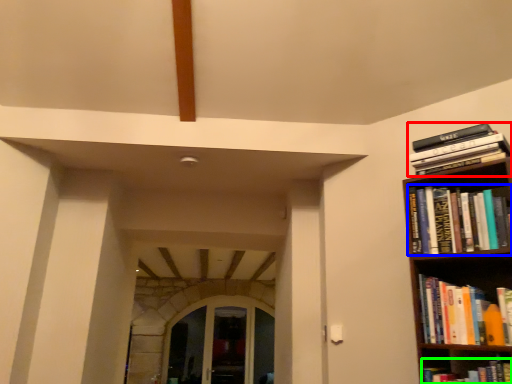
Question: Which object is positioned closest to book (highlighted by a red box)? Select from book (highlighted by a blue box) and book (highlighted by a green box).

Choices:
 (A) book
 (B) book

Answer: (A)